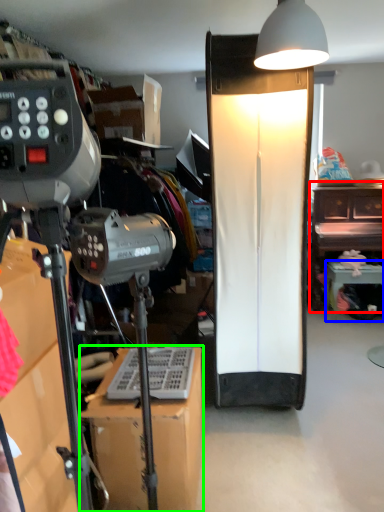
Question: Estimate the real-world distances between objects in this image. Which object is farther from furniture (highlighted by a red box), furniture (highlighted by a blue box) or furniture (highlighted by a green box)?

Choices:
 (A) furniture
 (B) furniture

Answer: (B)